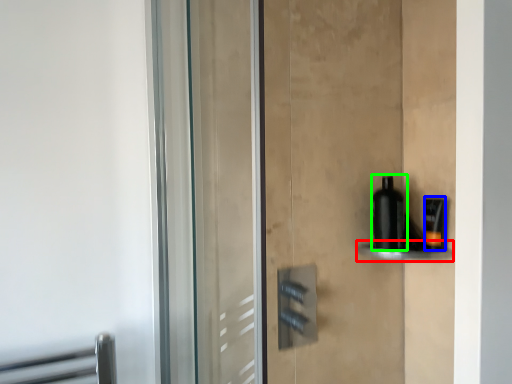
Question: Which object is the farthest from shelf (highlighted by a red box)? Choose among these: toiletry (highlighted by a blue box) or bottle (highlighted by a green box).

Choices:
 (A) toiletry
 (B) bottle

Answer: (B)